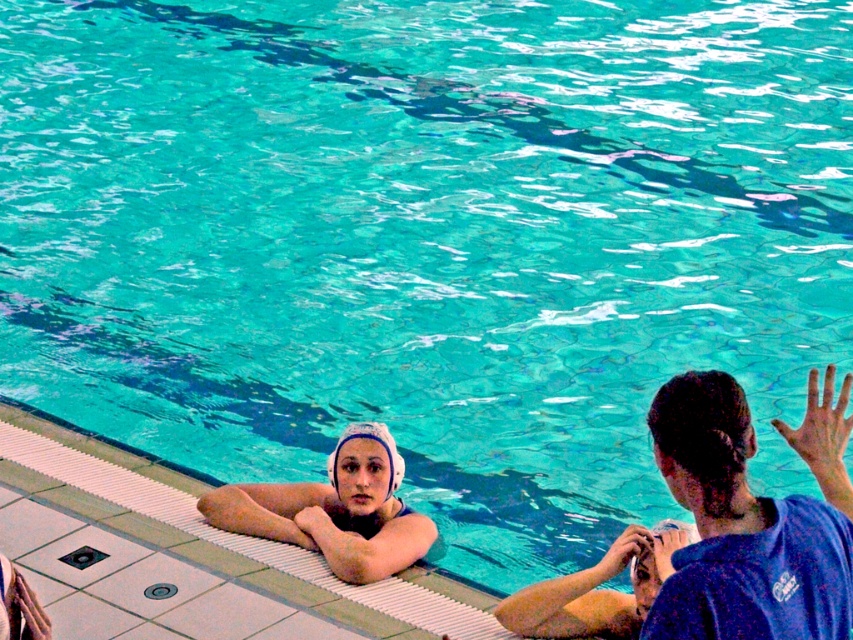
Question: Does blue cotton shirt at upper right appear over white matte swim cap at upper center?

Choices:
 (A) no
 (B) yes

Answer: (B)

Question: Which point is closer to the camera?

Choices:
 (A) (366, 528)
 (B) (827, 572)

Answer: (B)

Question: Is blue cotton shirt at upper right thinner than white matte swim cap at upper center?

Choices:
 (A) no
 (B) yes

Answer: (B)

Question: Does blue cotton shirt at upper right have a greater width compared to white matte swim cap at upper center?

Choices:
 (A) no
 (B) yes

Answer: (A)